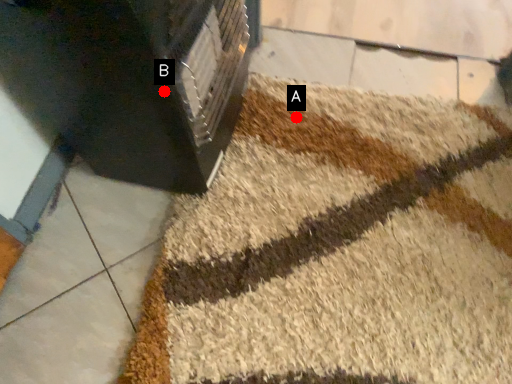
Question: Two points are circled on the image, labeled by A and B beside each circle. Which point appears closest to the camera in this image?

Choices:
 (A) A is closer
 (B) B is closer

Answer: (B)